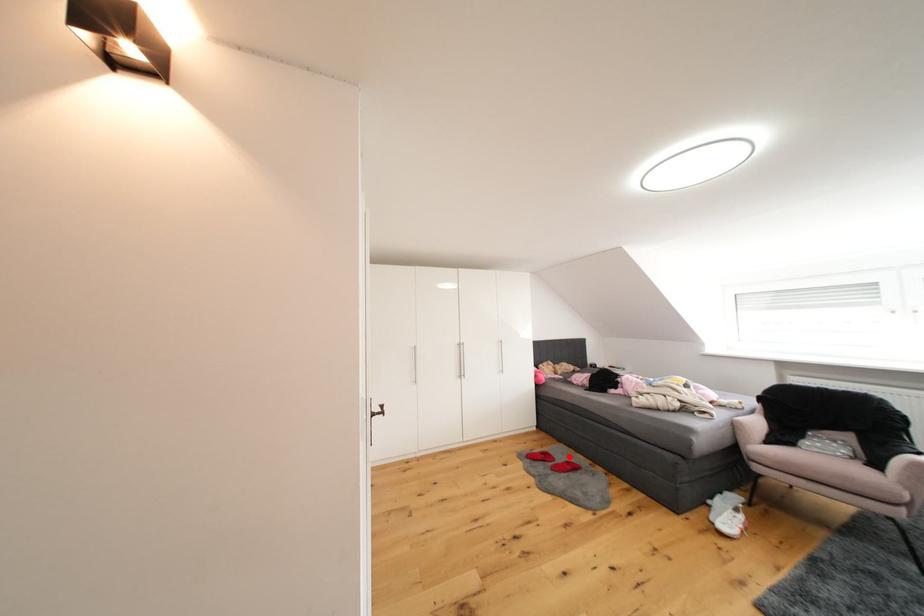
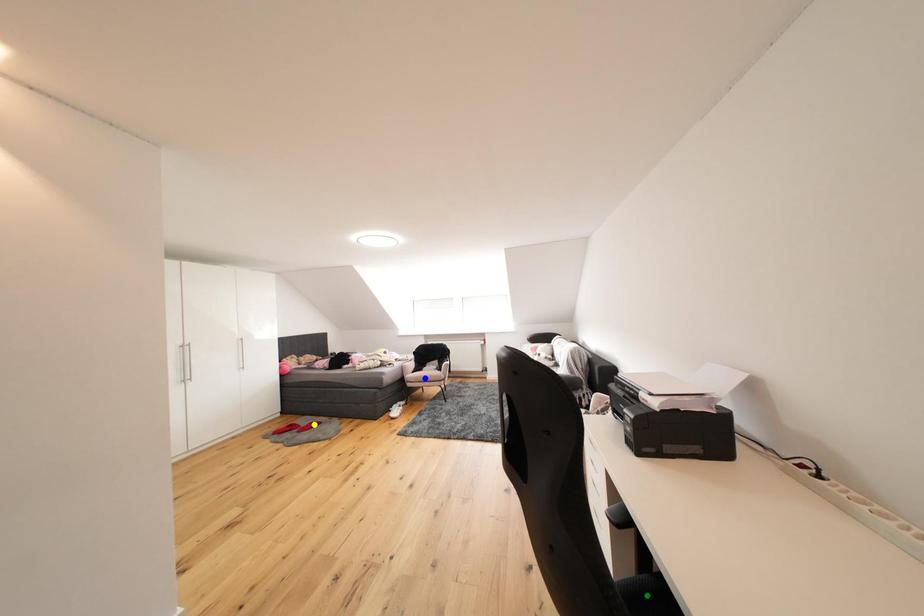
Question: I am providing you with two images of the same scene from different viewpoints. A red point is marked on the first image. You are given multiple points on the second image. Which point in image 2 represents the same 3d spot as the red point in image 1?

Choices:
 (A) blue point
 (B) green point
 (C) yellow point

Answer: (C)